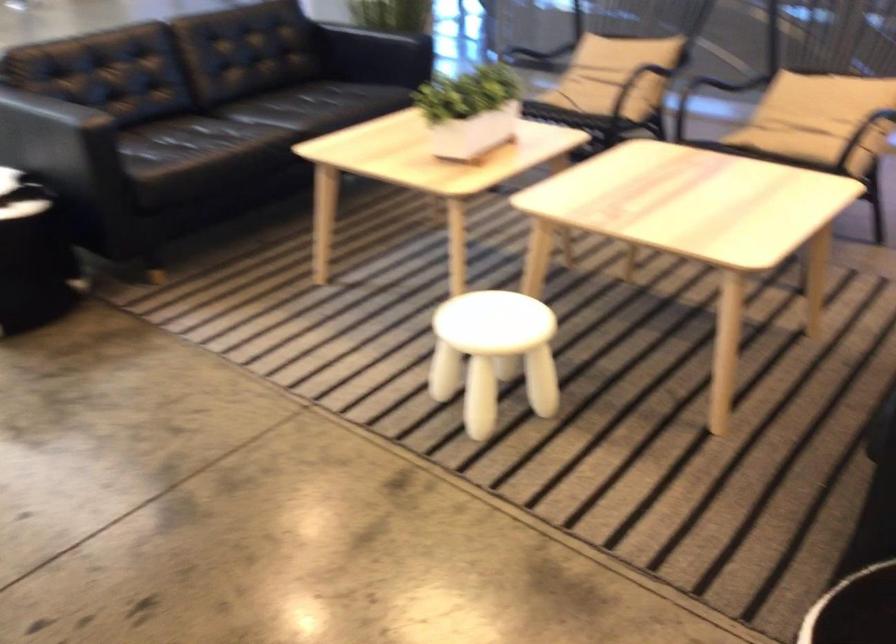
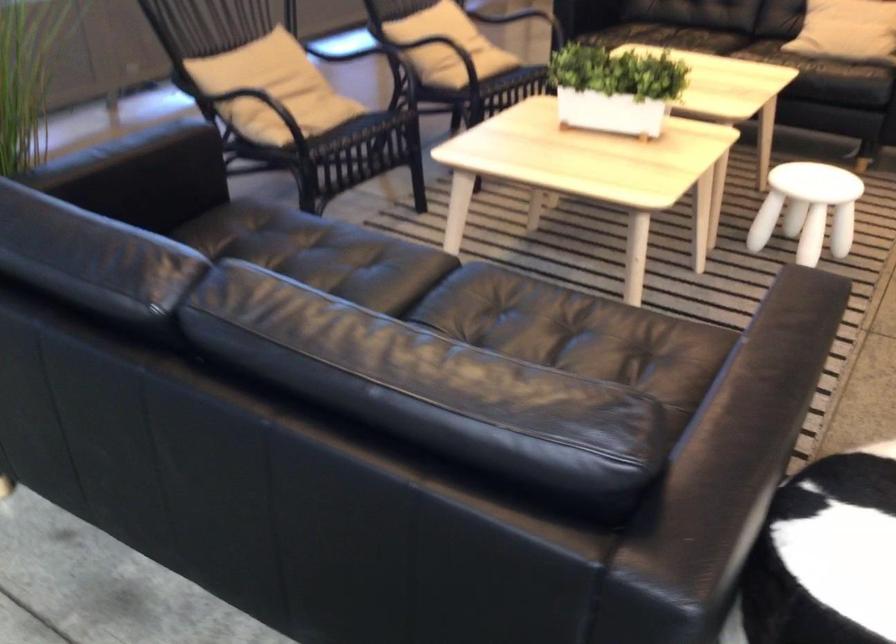
Where in the second image is the point corresponding to (460,109) from the first image?

(615, 88)